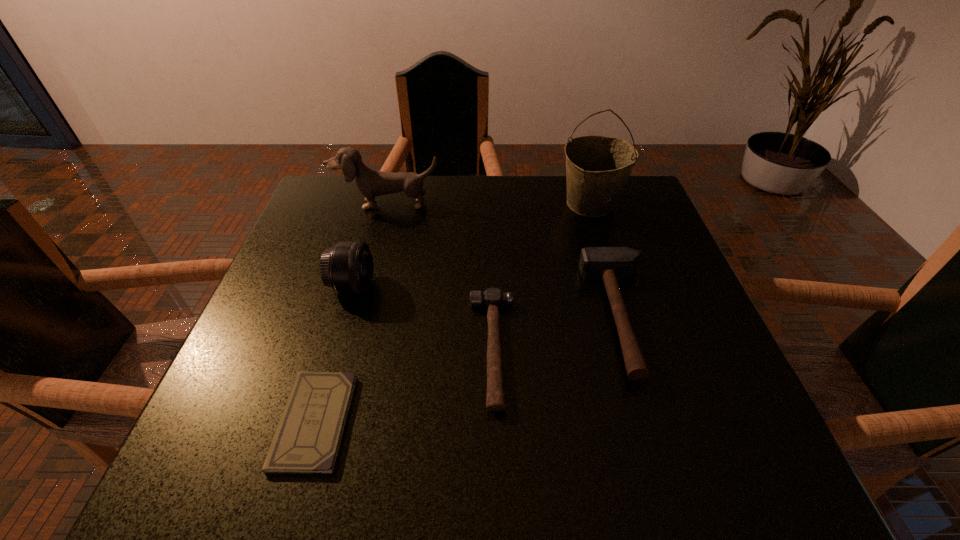
Locate an element on the screen. This screenshot has height=540, width=960. object present at the near edge is located at coordinates (307, 440).

At what (x,y) coordinates should I click in order to perform the action: click on puppy that is at the left edge. Please return your answer as a coordinate pair (x, y). Looking at the image, I should click on (371, 183).

This screenshot has height=540, width=960. I want to click on telephoto lens that is at the left edge, so click(348, 267).

Where is `checkbook at the left edge`? The width and height of the screenshot is (960, 540). checkbook at the left edge is located at coordinates (307, 440).

Identify the location of wine bucket located at the right edge. point(597,167).

Find the location of a particular element. hammer that is at the right edge is located at coordinates (610, 264).

Image resolution: width=960 pixels, height=540 pixels. In order to click on object that is at the far left corner in this screenshot , I will do `click(371, 183)`.

The height and width of the screenshot is (540, 960). Identify the location of object present at the near left corner. (307, 440).

Where is `object at the far right corner`? object at the far right corner is located at coordinates (597, 167).

This screenshot has width=960, height=540. In order to click on vacant point at the far edge in this screenshot , I will do `click(490, 192)`.